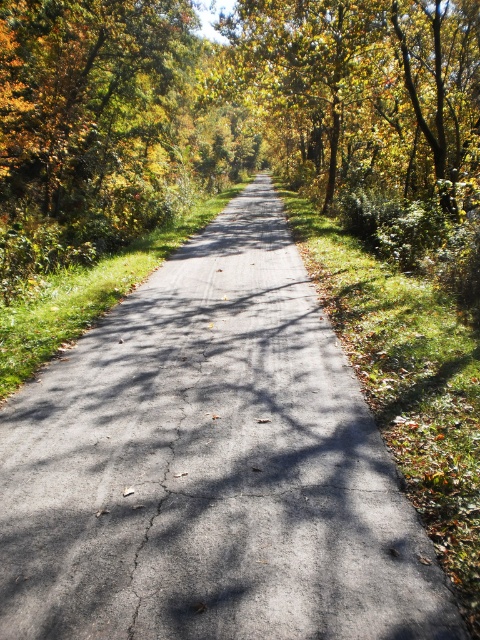
Image resolution: width=480 pixels, height=640 pixels. What do you see at coordinates (211, 467) in the screenshot?
I see `asphalt road at center` at bounding box center [211, 467].

Is asphalt road at center behind golden yellow leaves at upper center?

No, asphalt road at center is closer to the viewer.

Image resolution: width=480 pixels, height=640 pixels. I want to click on asphalt road at center, so click(211, 467).

Between asphalt road at center and golden foliage at center, which one appears on the left side from the viewer's perspective?

asphalt road at center is more to the left.

The width and height of the screenshot is (480, 640). Identify the location of asphalt road at center. (211, 467).

Locate an element on the screen. The width and height of the screenshot is (480, 640). asphalt road at center is located at coordinates (211, 467).

Can you confirm if golden foliage at center is positioned to the left of golden yellow leaves at upper center?

Correct, you'll find golden foliage at center to the left of golden yellow leaves at upper center.

The height and width of the screenshot is (640, 480). What do you see at coordinates (224, 109) in the screenshot? I see `golden foliage at center` at bounding box center [224, 109].

Is point (17, 224) less distant than point (382, 163)?

Yes.

Image resolution: width=480 pixels, height=640 pixels. In order to click on golden foliage at center in this screenshot , I will do `click(224, 109)`.